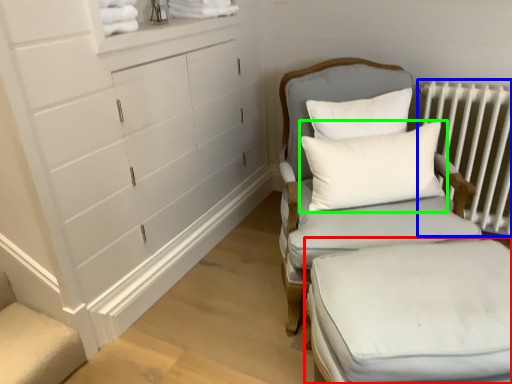
Question: Estimate the real-world distances between objects in this image. Which object is farther from changing table (highlighted by a red box), radiator (highlighted by a blue box) or pillow (highlighted by a green box)?

Choices:
 (A) radiator
 (B) pillow

Answer: (A)